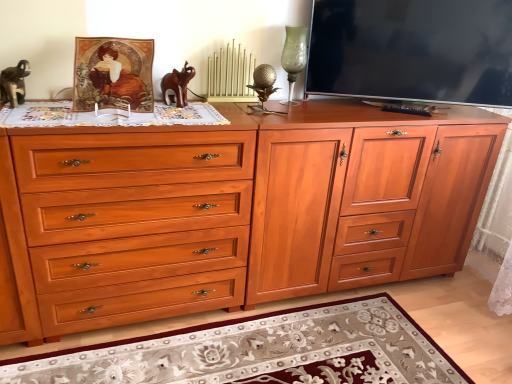
Image resolution: width=512 pixels, height=384 pixels. Identify the location of matte black tv at upper right. (413, 50).

Where is `shiny wood drawer at center`? The image size is (512, 384). shiny wood drawer at center is located at coordinates (132, 224).

Image resolution: width=512 pixels, height=384 pixels. What do you see at coordinates (132, 224) in the screenshot? I see `shiny wood drawer at center` at bounding box center [132, 224].

Image resolution: width=512 pixels, height=384 pixels. I want to click on gold textured golf ball at center, so click(x=264, y=87).

What do you see at coordinates (365, 195) in the screenshot?
I see `matte wood file cabinet at center` at bounding box center [365, 195].

What do you see at coordinates (260, 352) in the screenshot? I see `floral rug at lower center` at bounding box center [260, 352].

Find the location of `matte black tv at upper right`. matte black tv at upper right is located at coordinates (413, 50).

Between floral rug at lower center and matte wood file cabinet at center, which one appears on the right side from the viewer's perspective?

matte wood file cabinet at center.

How many degrees apart are the facing directions of floral rug at lower center and matte wood file cabinet at center?

There is a 0.234-degree angle between the facing directions of floral rug at lower center and matte wood file cabinet at center.

From the image's perspective, between floral rug at lower center and matte wood file cabinet at center, who is located below?

floral rug at lower center, from the image's perspective.

From a real-world perspective, between floral rug at lower center and matte wood file cabinet at center, who is vertically higher?

matte wood file cabinet at center is physically above.

Measure the distance from gold textured golf ball at center to green glass vase at upper center.

They are 9.11 inches apart.

Does gold textured golf ball at center touch green glass vase at upper center?

gold textured golf ball at center is not next to green glass vase at upper center, and they're not touching.

Is gold textured golf ball at center to the right of green glass vase at upper center from the viewer's perspective?

No.

Is gold textured golf ball at center oriented towards green glass vase at upper center?

No, gold textured golf ball at center does not turn towards green glass vase at upper center.

From a real-world perspective, is green glass vase at upper center above or below floral rug at lower center?

green glass vase at upper center is situated higher than floral rug at lower center in the real world.

I want to click on candle holder located behind the floral rug at lower center, so click(294, 58).

Considering the relative sizes of green glass vase at upper center and floral rug at lower center in the image provided, is green glass vase at upper center thinner than floral rug at lower center?

Yes, green glass vase at upper center is thinner than floral rug at lower center.

How different are the orientations of matte wood file cabinet at center and matte black tv at upper right in degrees?

They differ by 28.2 degrees in their facing directions.

From the image's perspective, is matte wood file cabinet at center under matte black tv at upper right?

Yes, from the image's perspective, matte wood file cabinet at center is beneath matte black tv at upper right.

In the scene shown: Is matte wood file cabinet at center looking in the opposite direction of matte black tv at upper right?

No, matte wood file cabinet at center is not facing away from matte black tv at upper right.

Considering the sizes of objects matte wood file cabinet at center and matte black tv at upper right in the image provided, who is bigger, matte wood file cabinet at center or matte black tv at upper right?

With larger size is matte wood file cabinet at center.

From a real-world perspective, is gold textured golf ball at center on gold metallic radiator at center?

No, from a real-world perspective, gold textured golf ball at center is not on top of gold metallic radiator at center.

How different are the orientations of gold textured golf ball at center and gold metallic radiator at center in degrees?

Result: There is a 2.77-degree angle between the facing directions of gold textured golf ball at center and gold metallic radiator at center.

Is gold textured golf ball at center smaller than gold metallic radiator at center?

Yes.

Is gold metallic radiator at center completely or partially inside gold textured golf ball at center?

No.

How different are the orientations of shiny wood drawer at center and brown wooden elephant at center in degrees?

They differ by 2.53 degrees in their facing directions.

Which object is positioned more to the left, shiny wood drawer at center or brown wooden elephant at center?

Positioned to the left is shiny wood drawer at center.

Based on their sizes in the image, would you say shiny wood drawer at center is bigger or smaller than brown wooden elephant at center?

Considering their sizes, shiny wood drawer at center takes up more space than brown wooden elephant at center.

Is shiny wood drawer at center not near brown wooden elephant at center?

No, shiny wood drawer at center is not far from brown wooden elephant at center.

Based on the photo, is matte black tv at upper right not inside green glass vase at upper center?

matte black tv at upper right is positioned outside green glass vase at upper center.

Can you tell me how much matte black tv at upper right and green glass vase at upper center differ in facing direction?

matte black tv at upper right and green glass vase at upper center are facing 28.6 degrees away from each other.

Is green glass vase at upper center at the back of matte black tv at upper right?

matte black tv at upper right does not have its back to green glass vase at upper center.

Considering the relative sizes of matte black tv at upper right and green glass vase at upper center in the image provided, is matte black tv at upper right taller than green glass vase at upper center?

Correct, matte black tv at upper right is much taller as green glass vase at upper center.

This screenshot has width=512, height=384. There is a floral rug at lower center. Find the location of `file cabinet above it (from a real-world perspective)`. file cabinet above it (from a real-world perspective) is located at coordinates (365, 195).

The image size is (512, 384). I want to click on candle holder on the right of gold textured golf ball at center, so click(294, 58).

Looking at this image, which object lies further to the anchor point green glass vase at upper center, gold metallic radiator at center or floral rug at lower center?

Among the two, floral rug at lower center is located further to green glass vase at upper center.

Estimate the real-world distances between objects in this image. Which object is further from green glass vase at upper center, matte black tv at upper right or shiny wood drawer at center?

Based on the image, shiny wood drawer at center appears to be further to green glass vase at upper center.

Based on their spatial positions, is gold textured golf ball at center or green glass vase at upper center further from matte black tv at upper right?

gold textured golf ball at center.

From the image, which object appears to be farther from brown wooden elephant at center, matte black tv at upper right or shiny wood drawer at center?

matte black tv at upper right is further to brown wooden elephant at center.

Based on their spatial positions, is green glass vase at upper center or gold metallic radiator at center closer to matte black tv at upper right?

The object closer to matte black tv at upper right is green glass vase at upper center.

From the image, which object appears to be nearer to gold metallic radiator at center, brown wooden elephant at center or matte black tv at upper right?

Among the two, brown wooden elephant at center is located nearer to gold metallic radiator at center.

Considering their positions, is gold textured golf ball at center positioned further to floral rug at lower center than matte wood file cabinet at center?

gold textured golf ball at center.

Looking at this image, based on their spatial positions, is green glass vase at upper center or shiny wood drawer at center closer to floral rug at lower center?

Among the two, shiny wood drawer at center is located nearer to floral rug at lower center.

Locate an element on the screen. The height and width of the screenshot is (384, 512). table lamp between green glass vase at upper center and shiny wood drawer at center in the up-down direction is located at coordinates (x=264, y=87).

The height and width of the screenshot is (384, 512). Identify the location of table lamp between matte black tv at upper right and floral rug at lower center vertically. (264, 87).

Identify the location of animal that lies between gold metallic radiator at center and floral rug at lower center from top to bottom. Image resolution: width=512 pixels, height=384 pixels. pos(177,85).

Find the location of a particular element. Image resolution: width=512 pixels, height=384 pixels. file cabinet between matte black tv at upper right and floral rug at lower center vertically is located at coordinates (365, 195).